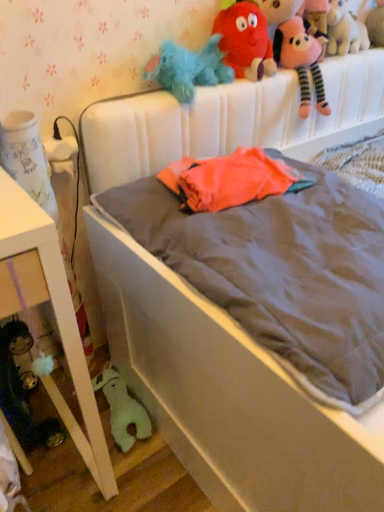
At what (x,y) coordinates should I click in order to perform the action: click on empty space that is ontop of green plush toy at lower left, marked as the 5th toy in a right-to-left arrangement (from a real-world perspective). Please return your answer as a coordinate pair (x, y). This screenshot has width=384, height=512. Looking at the image, I should click on (111, 394).